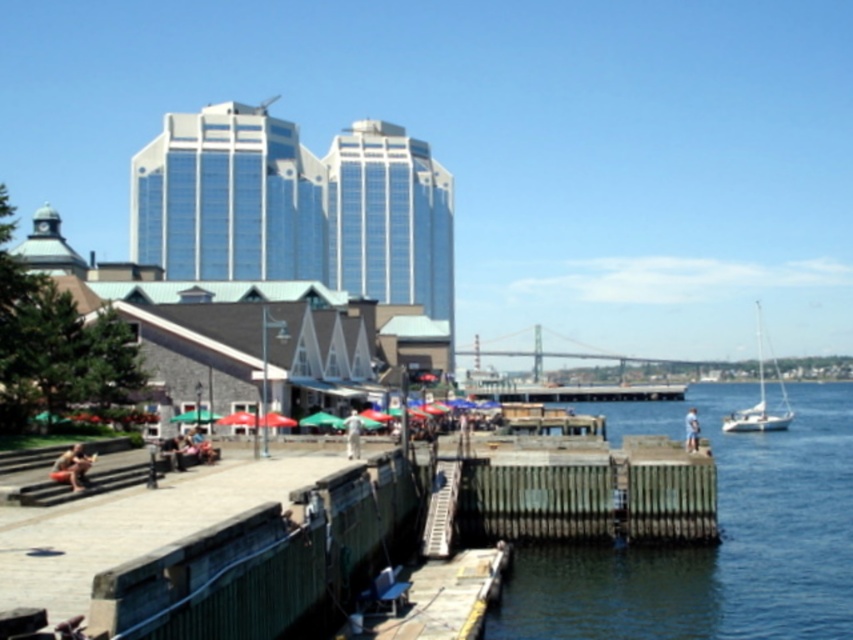
You are standing at the point where the staircase meets the dock. Looking towards the water, you see a point marked as point (720, 534). What is the nature of the surface at that point?

The surface at point (720, 534) is clear water, as indicated by the description of clear water at dock right corresponding to that coordinate.